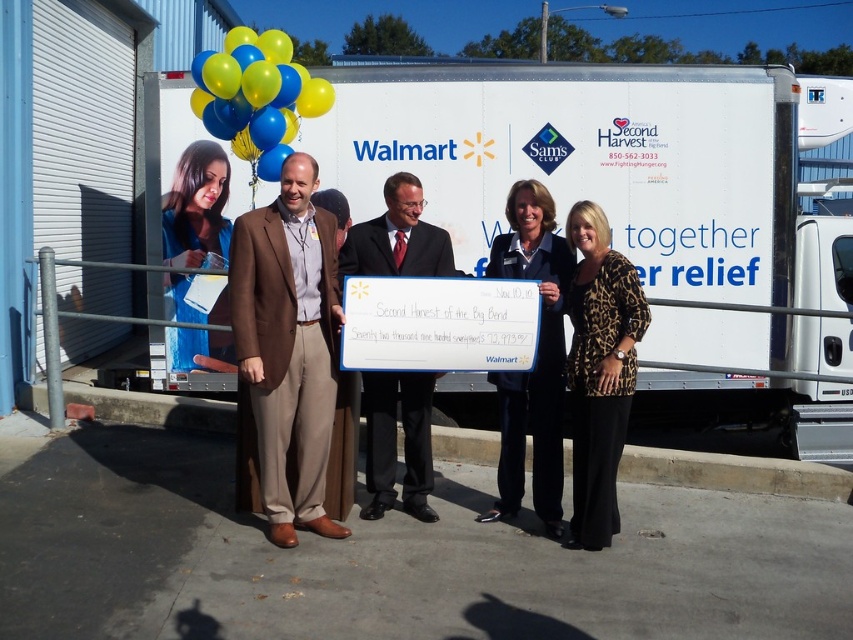
Question: Does brown fabric suit at center appear over brown suit at center?

Choices:
 (A) no
 (B) yes

Answer: (B)

Question: Which object appears farthest from the camera in this image?

Choices:
 (A) brown suit at center
 (B) brown fabric suit at center
 (C) blue glossy balloons at upper left

Answer: (C)

Question: Which object appears closest to the camera in this image?

Choices:
 (A) brown suit at center
 (B) white matte truck at center
 (C) blue glossy balloons at upper left

Answer: (A)

Question: Is dark blue suit at center above brown suit at center?

Choices:
 (A) no
 (B) yes

Answer: (B)

Question: Does dark blue suit at center have a lesser width compared to blue fabric at upper left?

Choices:
 (A) yes
 (B) no

Answer: (A)

Question: Based on their relative distances, which object is nearer to the blue glossy balloons at upper left?

Choices:
 (A) dark blue suit at center
 (B) brown suit at center

Answer: (B)